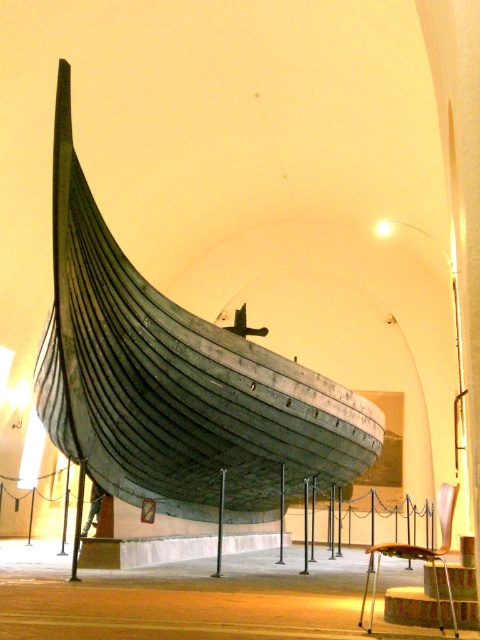
Does wooden boat at center have a greater width compared to wooden textured stool at lower right?

No, wooden boat at center is not wider than wooden textured stool at lower right.

Identify the location of wooden boat at center. This screenshot has width=480, height=640. (176, 381).

This screenshot has width=480, height=640. I want to click on wooden boat at center, so click(x=176, y=381).